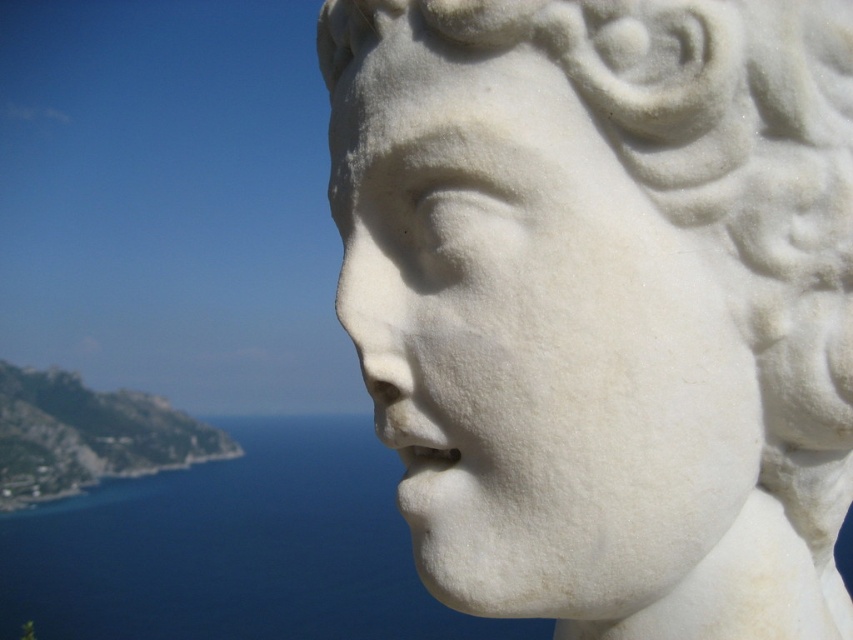
You are an art conservator tasked with cleaning the white marble face at center and the blue water at lower left. You have a 1.5 meter long brush. Can you reach both objects with the same brush without moving it?

The white marble face at center and the blue water at lower left are 1.28 meters apart from each other. Since the brush is 1.5 meters long, which is longer than the distance between them, you can reach both objects with the same brush without moving it.

You are an art conservator examining the statue from a distance. You notice two points on the statue head labeled as point (471, 563) and point (263, 524). Which point is nearer to your viewpoint?

Point (471, 563) is closer to the camera than point (263, 524).

You are an art student analyzing the sculpture and its background. Based on the image, which object occupies a larger portion of the visual space, the white marble face at center or the blue water at lower left?

The blue water at lower left occupies a larger portion of the visual space since the white marble face at center has a smaller size compared to it.